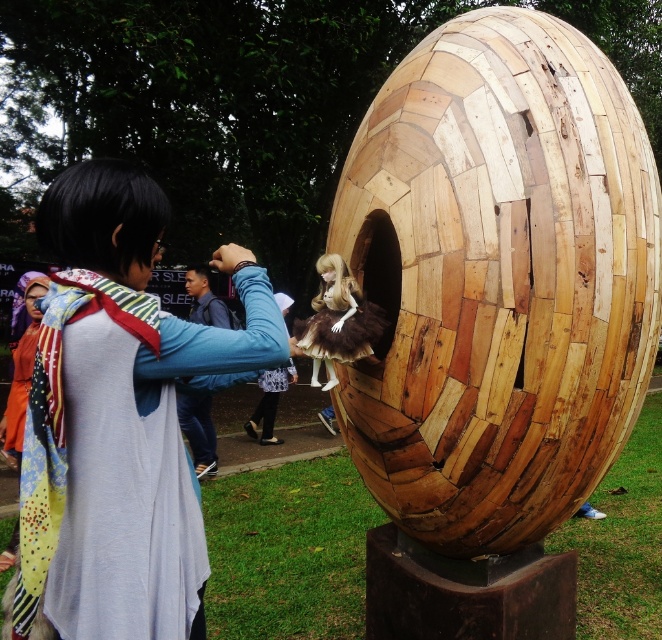
Between point (526, 516) and point (348, 324), which one is positioned in front?

Point (348, 324)

Does wooden egg at center have a greater height compared to matte brown doll at center?

Indeed, wooden egg at center has a greater height compared to matte brown doll at center.

Where is `wooden egg at center`? The height and width of the screenshot is (640, 662). wooden egg at center is located at coordinates (498, 280).

Is point (565, 339) more distant than point (52, 353)?

Yes, point (565, 339) is behind point (52, 353).

Between wooden egg at center and multicolored scarf at left, which one is positioned lower?

Positioned lower is multicolored scarf at left.

Is point (414, 136) positioned in front of point (261, 346)?

No.

The image size is (662, 640). In order to click on wooden egg at center in this screenshot , I will do (498, 280).

Where is `multicolored scarf at left`? The width and height of the screenshot is (662, 640). multicolored scarf at left is located at coordinates (120, 417).

Which is more to the right, multicolored scarf at left or matte brown doll at center?

From the viewer's perspective, matte brown doll at center appears more on the right side.

Is point (246, 356) closer to viewer compared to point (334, 348)?

Yes.

Image resolution: width=662 pixels, height=640 pixels. I want to click on multicolored scarf at left, so click(120, 417).